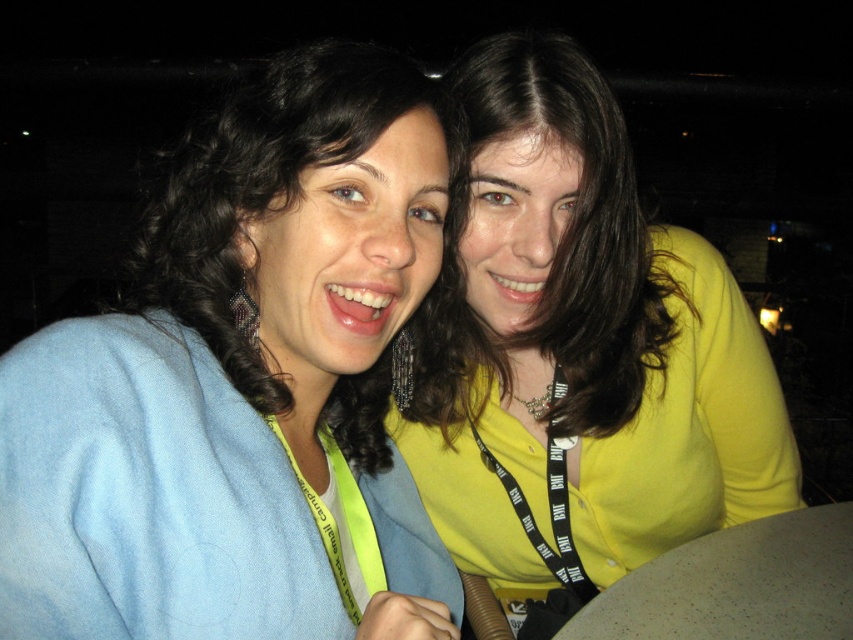
You are standing in front of the two people in the image. Which of the two points, point 1 at coordinates point (x=170, y=502) or point 2 at coordinates point (x=532, y=512), is closer to you?

Point 1 at coordinates point (x=170, y=502) is closer to you because it is in front of point 2 at coordinates point (x=532, y=512).

You are a photographer holding a camera that requires you to be at least 24 inches away from the subject to avoid blurring. You are currently positioned in front of the blue fabric at left. Is your current distance sufficient to take a clear photo without blurring?

The distance of blue fabric at left from viewer is 22.13 inches, which is less than the required 24 inches. Therefore, you need to move back to ensure a clear photo.